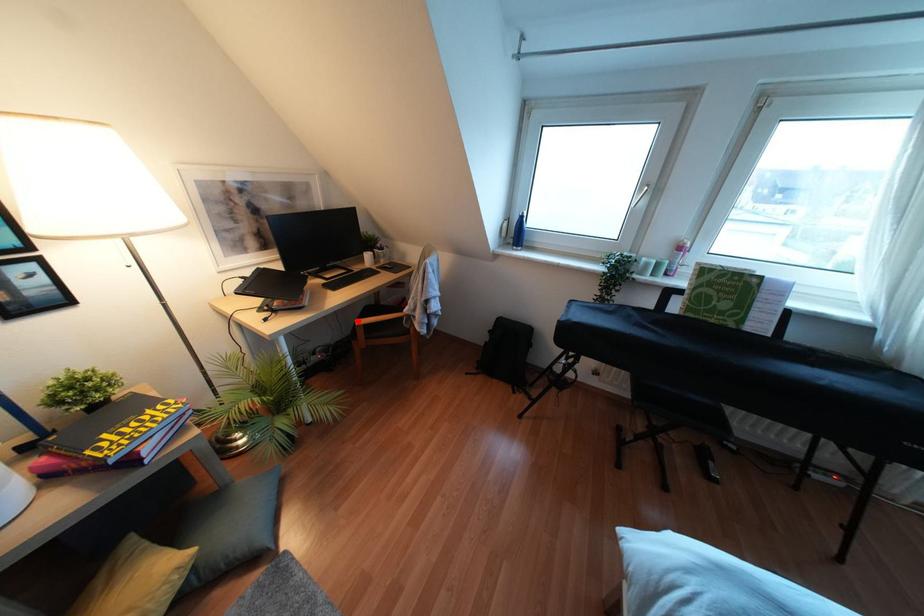
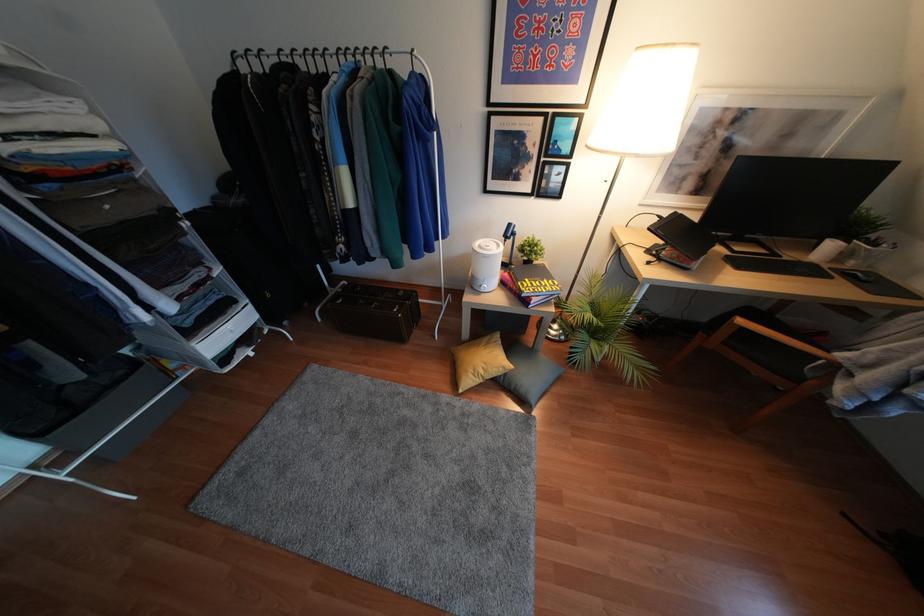
Question: I am providing you with two images of the same scene from different viewpoints. A red point is marked on the first image. Can you still see the location of the red point in image 2?

Choices:
 (A) Yes
 (B) No

Answer: (A)